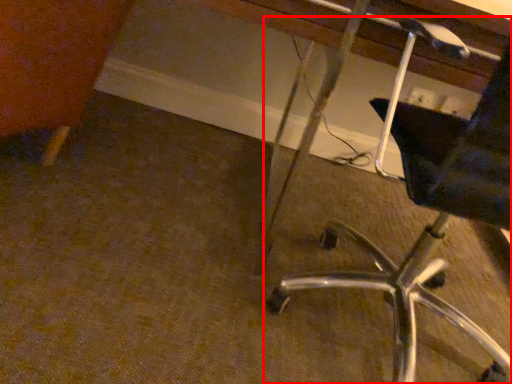
Question: From the image's perspective, where is chair (annotated by the red box) located in relation to vanity in the image?

Choices:
 (A) below
 (B) above

Answer: (A)